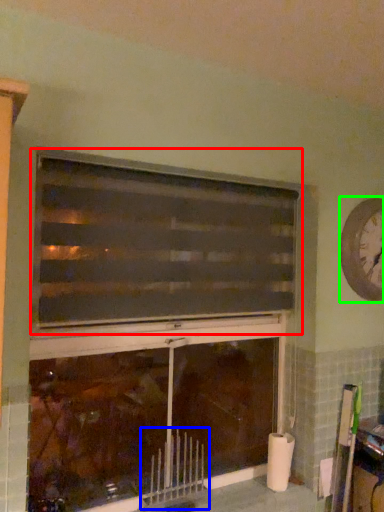
Question: Based on their relative distances, which object is farther from window (highlighted by a red box)? Choose from radiator (highlighted by a blue box) and clock (highlighted by a green box).

Choices:
 (A) radiator
 (B) clock

Answer: (A)